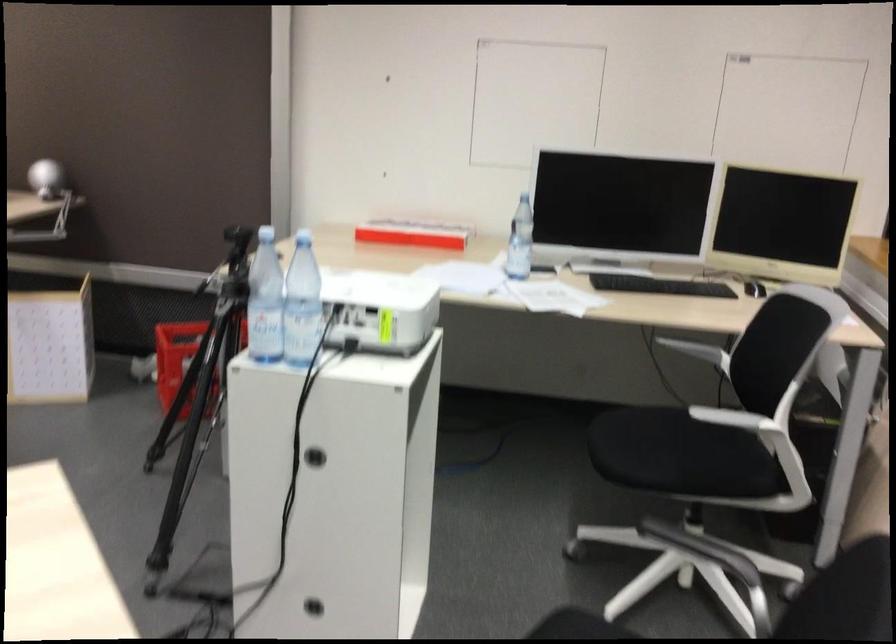
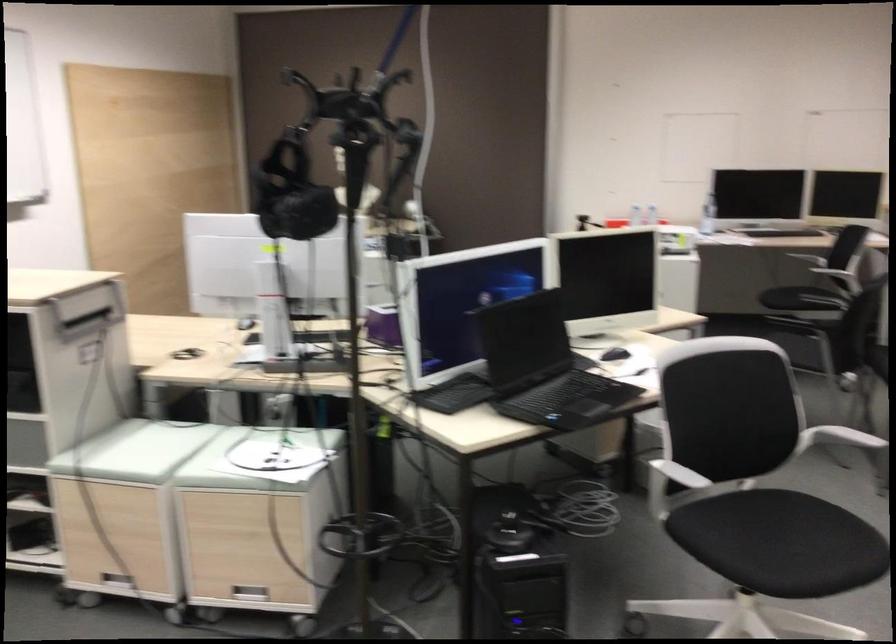
Question: I am providing you with two images of the same scene from different viewpoints. Please identify which objects are invisible in image2.

Choices:
 (A) white chair armrest
 (B) blue toy bin
 (C) black computer mouse
 (D) cabinet hole handle

Answer: (D)